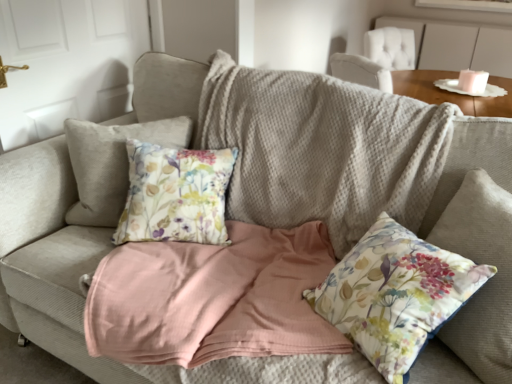
Question: Is floral fabric cushion at center in front of or behind wooden table at upper right in the image?

Choices:
 (A) behind
 (B) front

Answer: (B)

Question: Which is correct: floral fabric cushion at center is inside wooden table at upper right, or outside of it?

Choices:
 (A) inside
 (B) outside

Answer: (B)

Question: From the image's perspective, is floral fabric cushion at center positioned above or below wooden table at upper right?

Choices:
 (A) below
 (B) above

Answer: (A)

Question: Considering the positions of point (454, 72) and point (424, 327), is point (454, 72) closer or farther from the camera than point (424, 327)?

Choices:
 (A) closer
 (B) farther

Answer: (B)

Question: Visually, is wooden table at upper right positioned to the left or to the right of floral fabric cushion at center?

Choices:
 (A) right
 (B) left

Answer: (A)

Question: From a real-world perspective, is wooden table at upper right physically located above or below floral fabric cushion at center?

Choices:
 (A) below
 (B) above

Answer: (B)

Question: From the image's perspective, is wooden table at upper right located above or below floral fabric cushion at center?

Choices:
 (A) above
 (B) below

Answer: (A)